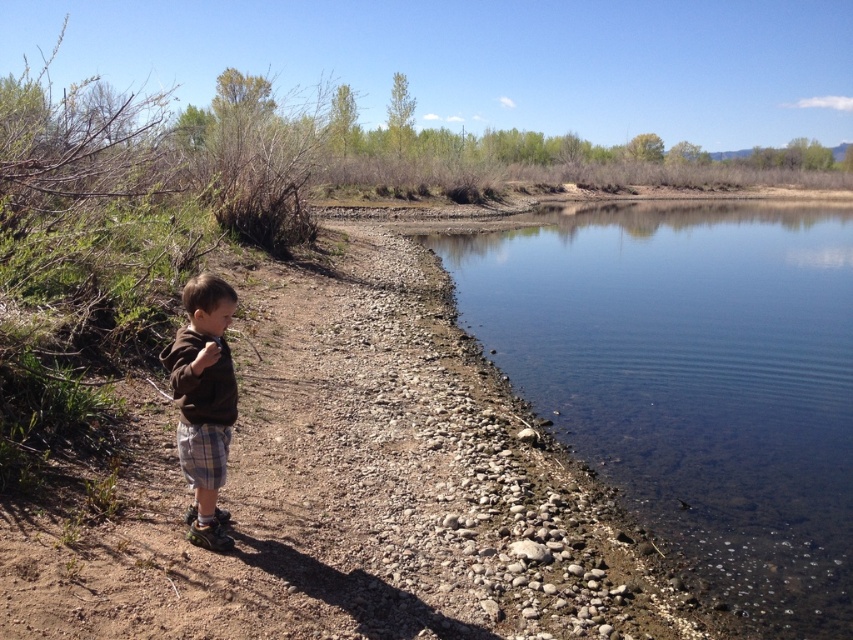
Who is lower down, clear water at river right or brown cotton shirt at left?

Positioned lower is brown cotton shirt at left.

Does clear water at river right have a lesser height compared to brown cotton shirt at left?

No, clear water at river right is not shorter than brown cotton shirt at left.

Does point (807, 627) come closer to viewer compared to point (223, 534)?

No, (807, 627) is behind (223, 534).

Identify the location of clear water at river right. (693, 381).

Consider the image. Who is positioned more to the right, brown dirt path at center or brown cotton shirt at left?

Positioned to the right is brown cotton shirt at left.

Who is shorter, brown dirt path at center or brown cotton shirt at left?

Standing shorter between the two is brown cotton shirt at left.

Find the location of `brown dirt path at center`. brown dirt path at center is located at coordinates (339, 490).

Can you confirm if brown dirt path at center is bigger than clear water at river right?

No.

Does brown dirt path at center have a lesser width compared to clear water at river right?

Indeed, brown dirt path at center has a lesser width compared to clear water at river right.

Between point (300, 269) and point (634, 492), which one is positioned behind?

Positioned behind is point (300, 269).

The height and width of the screenshot is (640, 853). What are the coordinates of `brown dirt path at center` in the screenshot? It's located at (339, 490).